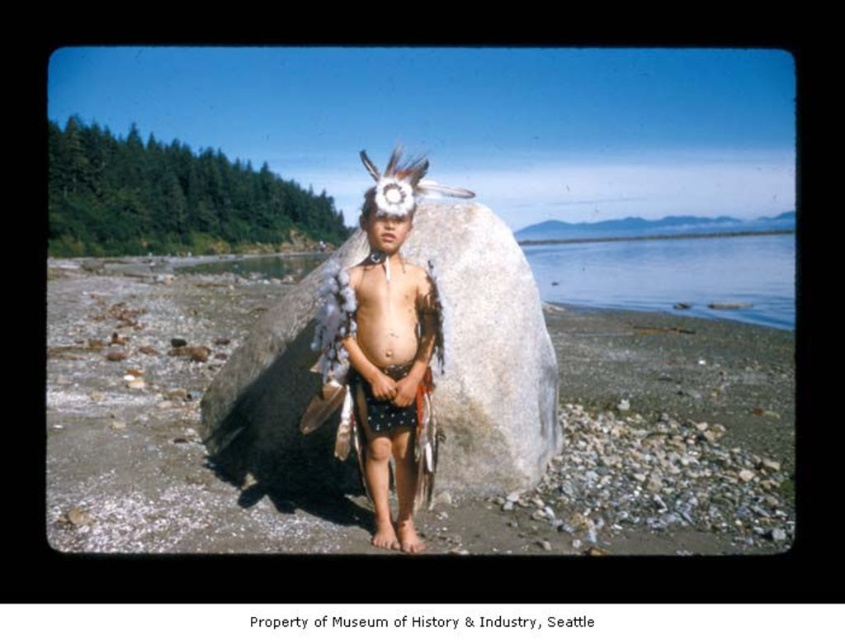
Based on the scene described, can you determine which object is located above the other between the white feather headdress at center and the clear water at center?

The white feather headdress at center is positioned under the clear water at center, so the clear water at center is above the white feather headdress at center.

Looking at this image, you are a photographer aiming to capture the white feather headdress at center and the clear water at center in a single frame. Based on their heights, which object will appear smaller in the photo?

The white feather headdress at center will appear smaller in the photo because it has a lesser height compared to the clear water at center.